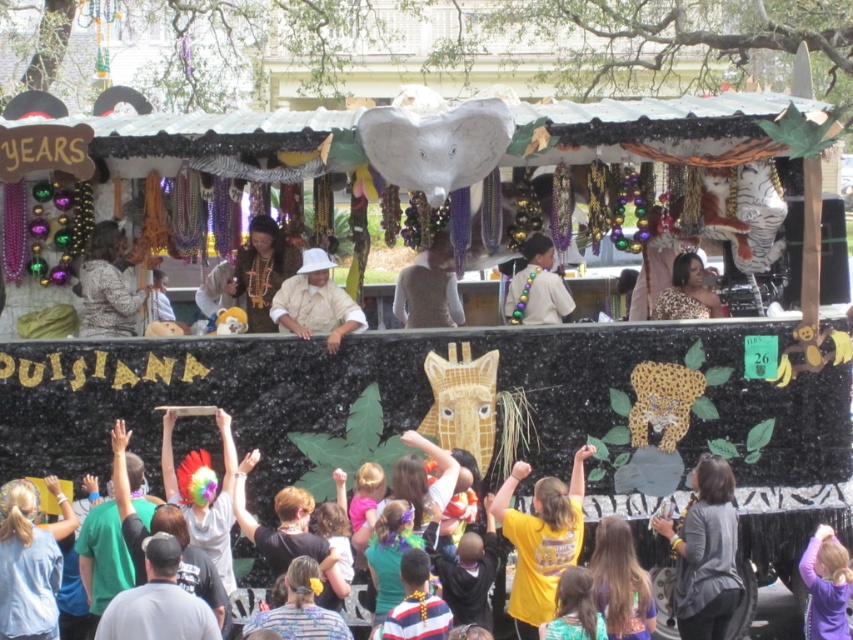
Question: Which object appears closest to the camera in this image?

Choices:
 (A) white matte hat at center
 (B) beige fabric lei at center
 (C) matte gold necklace at center
 (D) knitted beige sweater at upper left

Answer: (A)

Question: Considering the relative positions of purple fabric at lower right and beige fabric lei at center in the image provided, where is purple fabric at lower right located with respect to beige fabric lei at center?

Choices:
 (A) right
 (B) left

Answer: (A)

Question: Which point is farther to the camera?

Choices:
 (A) (453, 284)
 (B) (113, 269)

Answer: (A)

Question: Is matte gold necklace at center smaller than smooth brown hair at lower center?

Choices:
 (A) no
 (B) yes

Answer: (B)

Question: Which point is closer to the camera?

Choices:
 (A) matte gold necklace at center
 (B) leopard print dress at center
 (C) beige fabric lei at center
 (D) purple fabric at lower right

Answer: (D)

Question: Does knitted beige sweater at upper left have a greater width compared to beige fabric lei at center?

Choices:
 (A) no
 (B) yes

Answer: (A)